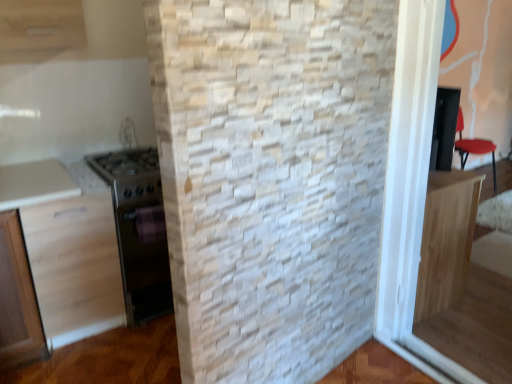
Question: Is metallic stainless steel oven at left thinner than light wood cabinet at left, which is counted as the 2th cabinetry, starting from the right?

Choices:
 (A) no
 (B) yes

Answer: (A)

Question: Is metallic stainless steel oven at left taller than light wood cabinet at left, arranged as the first cabinetry when viewed from the left?

Choices:
 (A) yes
 (B) no

Answer: (B)

Question: Does metallic stainless steel oven at left lie behind light wood cabinet at left, which is counted as the 2th cabinetry, starting from the right?

Choices:
 (A) yes
 (B) no

Answer: (A)

Question: Is metallic stainless steel oven at left not within light wood cabinet at left, arranged as the first cabinetry when viewed from the left?

Choices:
 (A) no
 (B) yes

Answer: (B)

Question: Is metallic stainless steel oven at left not close to light wood cabinet at left, arranged as the first cabinetry when viewed from the left?

Choices:
 (A) no
 (B) yes

Answer: (A)

Question: Is the depth of metallic stainless steel oven at left less than that of light wood cabinet at left, arranged as the first cabinetry when viewed from the left?

Choices:
 (A) yes
 (B) no

Answer: (B)

Question: Considering the relative positions of metallic stainless steel oven at left and light wood cabinet at right, the 2th cabinetry positioned from the left, in the image provided, is metallic stainless steel oven at left in front of light wood cabinet at right, the 2th cabinetry positioned from the left,?

Choices:
 (A) no
 (B) yes

Answer: (A)

Question: Is metallic stainless steel oven at left outside of light wood cabinet at right, the 2th cabinetry positioned from the left?

Choices:
 (A) no
 (B) yes

Answer: (B)

Question: Is the surface of metallic stainless steel oven at left in direct contact with light wood cabinet at right, the 2th cabinetry positioned from the left?

Choices:
 (A) no
 (B) yes

Answer: (A)

Question: Is metallic stainless steel oven at left facing away from light wood cabinet at right, the 2th cabinetry positioned from the left?

Choices:
 (A) yes
 (B) no

Answer: (B)

Question: Can you confirm if metallic stainless steel oven at left is shorter than light wood cabinet at right, the 2th cabinetry positioned from the left?

Choices:
 (A) yes
 (B) no

Answer: (A)

Question: From a real-world perspective, is metallic stainless steel oven at left on top of light wood cabinet at right, the 2th cabinetry positioned from the left?

Choices:
 (A) yes
 (B) no

Answer: (B)

Question: Would you say light wood cabinet at left, arranged as the first cabinetry when viewed from the left, is outside light wood cabinet at right, the 1th cabinetry from the right?

Choices:
 (A) no
 (B) yes

Answer: (B)